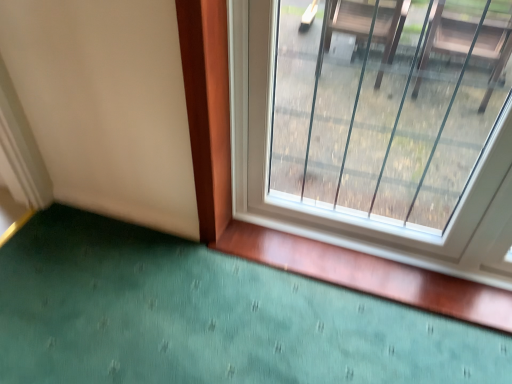
Find the location of `transparent glass window at right`. transparent glass window at right is located at coordinates (376, 126).

This screenshot has height=384, width=512. Describe the element at coordinates (376, 126) in the screenshot. I see `transparent glass window at right` at that location.

Locate an element on the screen. The image size is (512, 384). transparent glass window at right is located at coordinates point(376,126).